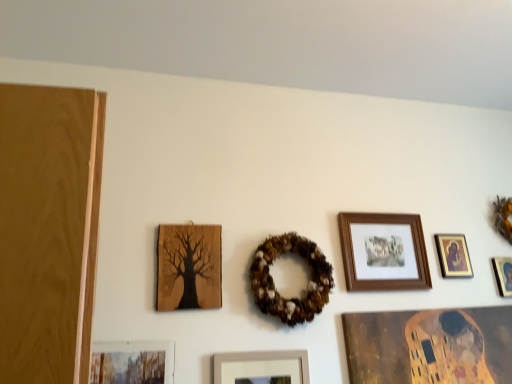
Question: Looking at their shapes, would you say gold-framed picture at upper right, the 2th picture frame viewed from the right, is wider or thinner than orange fabric wreath at upper right, which is counted as the 2th decor, starting from the front?

Choices:
 (A) thin
 (B) wide

Answer: (A)

Question: From a real-world perspective, is gold-framed picture at upper right, the fifth picture frame from the left, physically located above or below orange fabric wreath at upper right, which is the 1th decor in right-to-left order?

Choices:
 (A) above
 (B) below

Answer: (B)

Question: Based on their relative distances, which object is nearer to the brown textured wreath at center, which is the 1th decor from front to back?

Choices:
 (A) gold-framed picture at upper right, the 2th picture frame viewed from the right
 (B) wooden tree silhouette at left, which is the 2th picture frame from left to right
 (C) orange fabric wreath at upper right, which appears as the 2th decor when viewed from the left
 (D) matte black picture frame at upper right, the 1th picture frame positioned from the right
 (E) wooden framed photo at center right, positioned as the 4th picture frame in left-to-right order

Answer: (B)

Question: Which of these objects is positioned farthest from the matte wooden frame at lower left, marked as the first picture frame in a left-to-right arrangement?

Choices:
 (A) wooden tree silhouette at left, arranged as the fifth picture frame when viewed from the right
 (B) matte black picture frame at upper right, the 6th picture frame from the left
 (C) orange fabric wreath at upper right, which is counted as the 2th decor, starting from the front
 (D) brown textured wreath at center, the 1th decor viewed from the left
 (E) wooden framed photo at center right, positioned as the 4th picture frame in left-to-right order

Answer: (C)